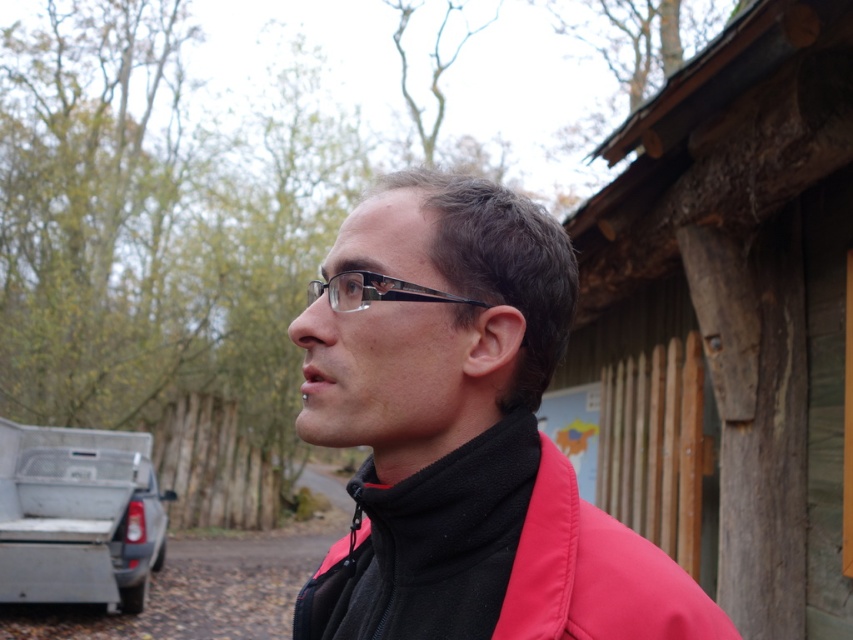
You are a photographer trying to capture a wide shot of the wooden at right and the silver metallic truck at lower left. Based on their sizes in the image, which object would you need to position closer to the camera to make them appear the same size in the photo?

The wooden at right is not as tall as the silver metallic truck at lower left, so to make them appear the same size in the photo, you would need to position the wooden at right closer to the camera than the silver metallic truck at lower left.

You are a photographer trying to capture a shot of the wooden at right and the pink matte jacket at center. Since you want both subjects in the frame, which direction should you move to ensure both are visible?

You should move to the left to ensure both the wooden at right and the pink matte jacket at center are visible in the frame since the wooden at right is to the right of the pink matte jacket at center.

You are a photographer trying to capture a shot of the wooden at right and the black plastic glasses at center. Which object should you focus on first if you want to ensure both are in sharp focus?

You should focus on the wooden at right first because it is closer to you than the black plastic glasses at center, ensuring both will be in focus when using a shallow depth of field.